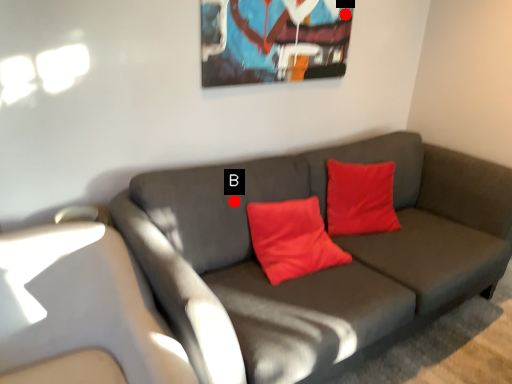
Question: Two points are circled on the image, labeled by A and B beside each circle. Among these points, which one is farthest from the camera?

Choices:
 (A) A is further
 (B) B is further

Answer: (A)